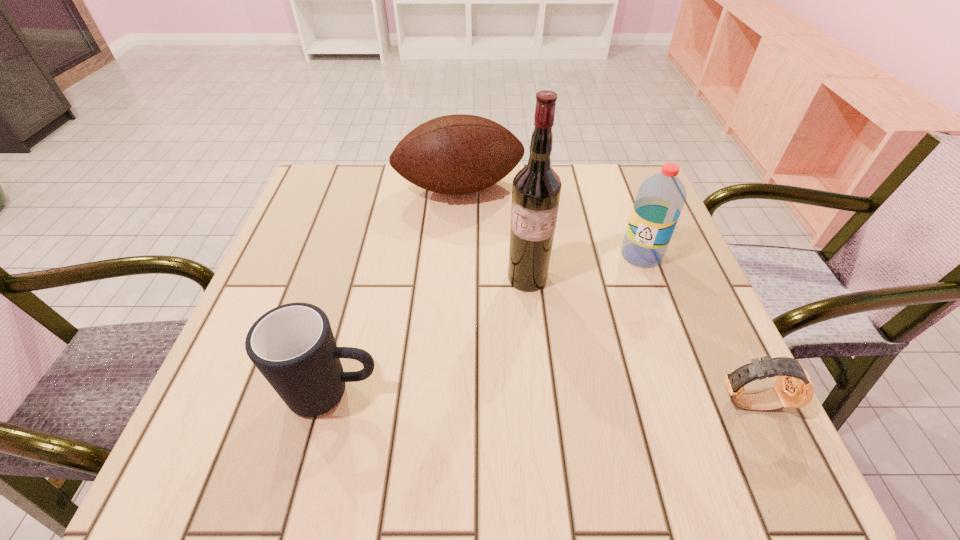
Identify the location of vacant space on the desktop that is between the fourth tallest object and the watch and is positioned on the front and back of the tallest object. This screenshot has height=540, width=960. (502, 396).

Find the location of `vacant space on the desktop that is between the mug and the shortest object and is positioned on the front label of the water bottle`. vacant space on the desktop that is between the mug and the shortest object and is positioned on the front label of the water bottle is located at coordinates (507, 396).

This screenshot has height=540, width=960. Find the location of `vacant spot on the desktop that is between the second shortest object and the shortest object and is positioned on the laces of the farthest object`. vacant spot on the desktop that is between the second shortest object and the shortest object and is positioned on the laces of the farthest object is located at coordinates (523, 397).